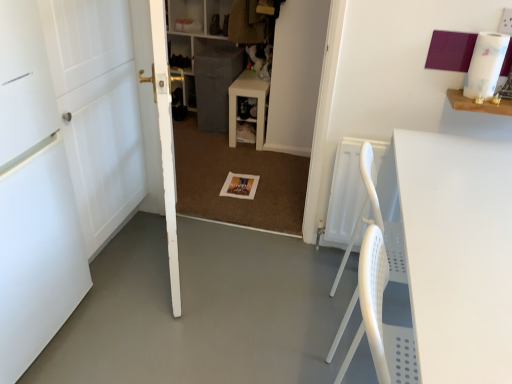
Where is `vacant space to the right of white wooden door at left, which is counted as the 1th door, starting from the right`? The image size is (512, 384). vacant space to the right of white wooden door at left, which is counted as the 1th door, starting from the right is located at coordinates (252, 274).